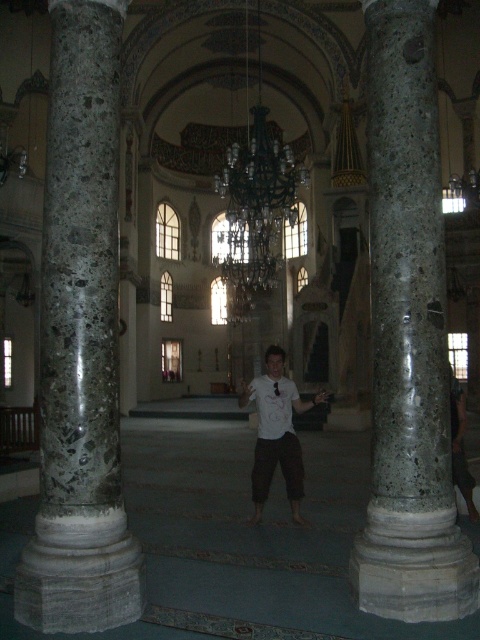
Question: Is marble column at left bigger than white matte shirt at center?

Choices:
 (A) no
 (B) yes

Answer: (B)

Question: Is white matte shirt at center closer to camera compared to dark brown leather pants at right?

Choices:
 (A) no
 (B) yes

Answer: (A)

Question: Which object appears farthest from the camera in this image?

Choices:
 (A) marble column at left
 (B) marble column at center

Answer: (B)

Question: Considering the real-world distances, which object is farthest from the white matte shirt at center?

Choices:
 (A) marble column at left
 (B) marble column at center
 (C) dark brown leather pants at right

Answer: (A)

Question: Can you confirm if marble column at center is positioned to the left of dark brown leather pants at right?

Choices:
 (A) no
 (B) yes

Answer: (B)

Question: Which of the following is the farthest from the observer?

Choices:
 (A) marble column at left
 (B) white matte shirt at center

Answer: (B)